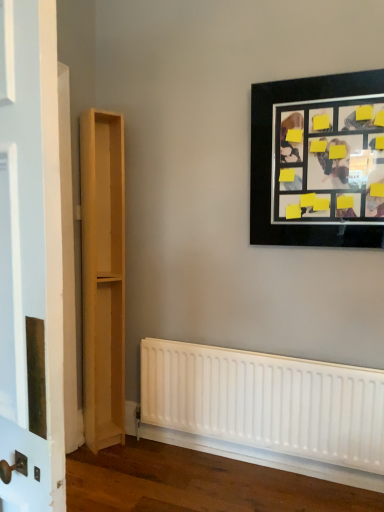
Where is `vacant region in front of light wood bookshelf at left`? vacant region in front of light wood bookshelf at left is located at coordinates (101, 460).